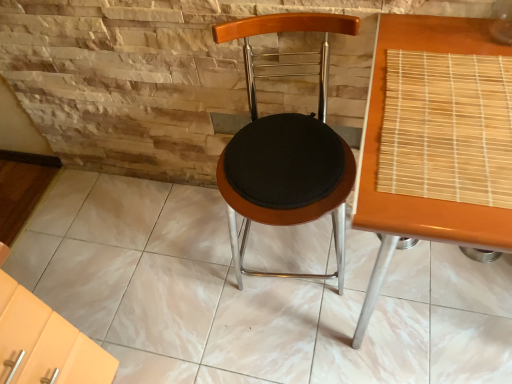
Question: Considering the relative positions of bamboo mat at right and wooden bamboo mat at right in the image provided, is bamboo mat at right behind wooden bamboo mat at right?

Choices:
 (A) yes
 (B) no

Answer: (A)

Question: From the image's perspective, would you say bamboo mat at right is positioned over wooden bamboo mat at right?

Choices:
 (A) yes
 (B) no

Answer: (A)

Question: Does bamboo mat at right have a greater width compared to wooden bamboo mat at right?

Choices:
 (A) no
 (B) yes

Answer: (A)

Question: Does bamboo mat at right appear on the left side of wooden bamboo mat at right?

Choices:
 (A) no
 (B) yes

Answer: (B)

Question: Is bamboo mat at right in contact with wooden bamboo mat at right?

Choices:
 (A) no
 (B) yes

Answer: (B)

Question: Is woodenseat cushion at center inside or outside of bamboo mat at right?

Choices:
 (A) inside
 (B) outside

Answer: (B)

Question: Considering the relative positions of woodenseat cushion at center and bamboo mat at right in the image provided, is woodenseat cushion at center to the left or to the right of bamboo mat at right?

Choices:
 (A) left
 (B) right

Answer: (A)

Question: In terms of width, does woodenseat cushion at center look wider or thinner when compared to bamboo mat at right?

Choices:
 (A) wide
 (B) thin

Answer: (A)

Question: From the image's perspective, is woodenseat cushion at center above or below bamboo mat at right?

Choices:
 (A) below
 (B) above

Answer: (A)

Question: Visually, is wooden bamboo mat at right positioned to the left or to the right of bamboo mat at right?

Choices:
 (A) right
 (B) left

Answer: (A)

Question: Do you think wooden bamboo mat at right is within bamboo mat at right, or outside of it?

Choices:
 (A) inside
 (B) outside

Answer: (B)

Question: Considering the positions of wooden bamboo mat at right and bamboo mat at right in the image, is wooden bamboo mat at right taller or shorter than bamboo mat at right?

Choices:
 (A) tall
 (B) short

Answer: (A)

Question: In terms of size, does wooden bamboo mat at right appear bigger or smaller than bamboo mat at right?

Choices:
 (A) small
 (B) big

Answer: (B)

Question: Based on their sizes in the image, would you say woodenseat cushion at center is bigger or smaller than wooden bamboo mat at right?

Choices:
 (A) small
 (B) big

Answer: (A)

Question: Considering the positions of woodenseat cushion at center and wooden bamboo mat at right in the image, is woodenseat cushion at center wider or thinner than wooden bamboo mat at right?

Choices:
 (A) thin
 (B) wide

Answer: (A)